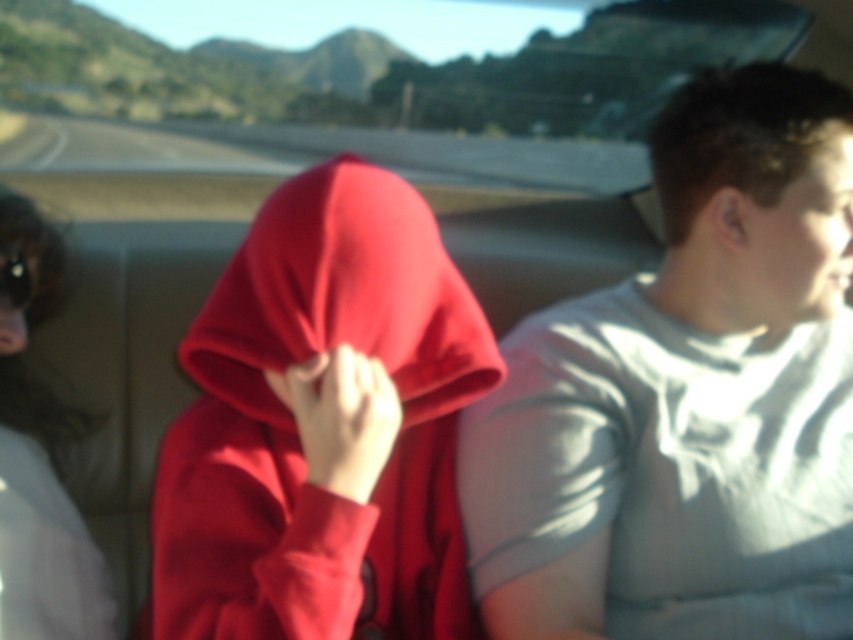
Question: Is light gray cotton t-shirt at right in front of matte red hoodie at center?

Choices:
 (A) no
 (B) yes

Answer: (A)

Question: Is sunglasses at left positioned before matte black goggles at upper left?

Choices:
 (A) yes
 (B) no

Answer: (A)

Question: Estimate the real-world distances between objects in this image. Which object is farther from the matte red hoodie at center?

Choices:
 (A) light gray cotton t-shirt at right
 (B) sunglasses at left
 (C) matte black goggles at upper left

Answer: (C)

Question: Does light gray cotton t-shirt at right have a smaller size compared to matte red hoodie at center?

Choices:
 (A) no
 (B) yes

Answer: (A)

Question: Among these points, which one is farthest from the camera?

Choices:
 (A) (296, 353)
 (B) (578, 515)

Answer: (B)

Question: Estimate the real-world distances between objects in this image. Which object is closer to the matte black goggles at upper left?

Choices:
 (A) light gray cotton t-shirt at right
 (B) matte red hoodie at center
 (C) sunglasses at left

Answer: (C)